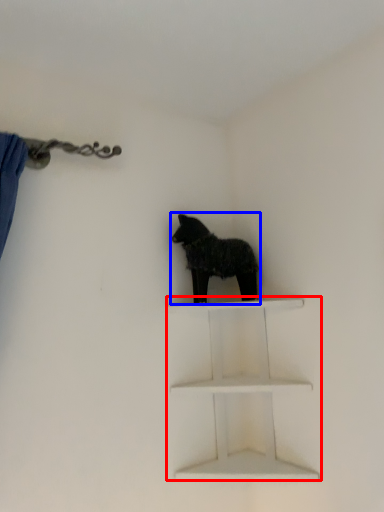
Question: Which object is closer to the camera taking this photo, shelf (highlighted by a red box) or dog (highlighted by a blue box)?

Choices:
 (A) shelf
 (B) dog

Answer: (A)